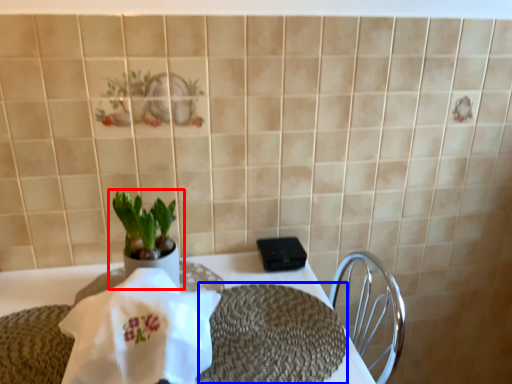
Question: Which of the following is the farthest to the observer, houseplant (highlighted by a red box) or place mat (highlighted by a blue box)?

Choices:
 (A) houseplant
 (B) place mat

Answer: (A)